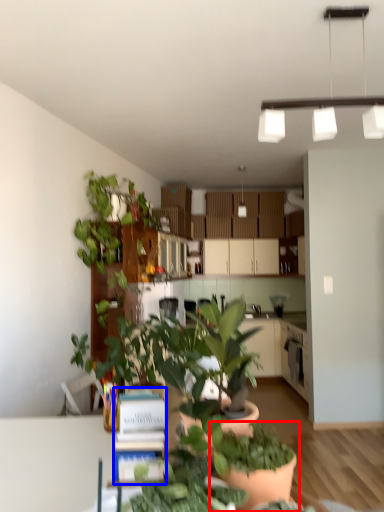
Question: Which object appears closest to the camera in this image, houseplant (highlighted by a red box) or book (highlighted by a blue box)?

Choices:
 (A) houseplant
 (B) book

Answer: (A)